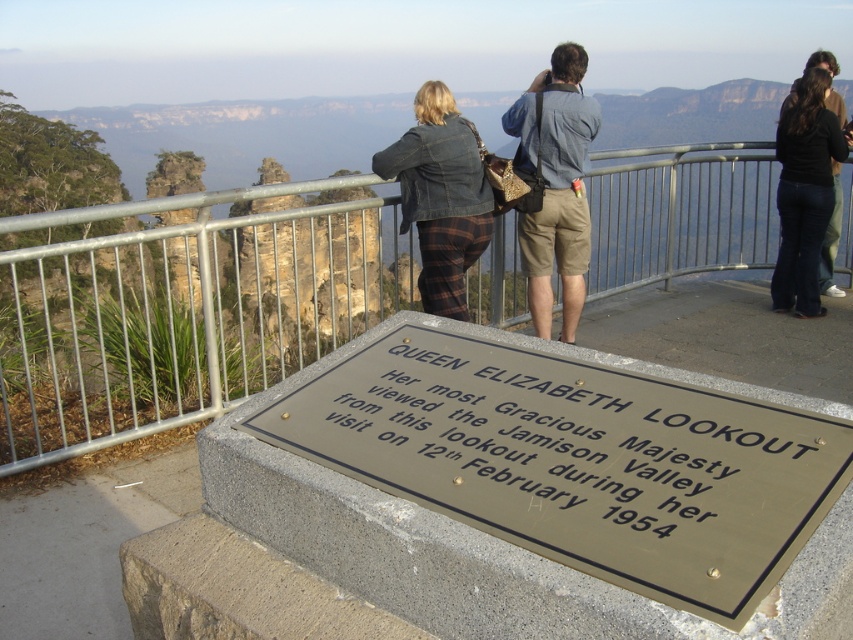
You are standing at the Queen Elizabeth Lookout, and you want to reach the plaque mounted on the stone base. The plaque is located at point (521, 99). There is a metal railing between you and the plaque. Can you safely step over the railing to touch the plaque?

The distance between you and the plaque at point (521, 99) is 4.97 meters. Since the metal railing is in between, stepping over it to touch the plaque would not be safe as the distance is too far and the railing is a safety barrier.

You are a tourist at Queen Elizabeth Lookout. You see the silver metallic rail at center and the matte blue shirt at center. Which object is more to the left?

The silver metallic rail at center is positioned on the left side of matte blue shirt at center, so it is more to the left.